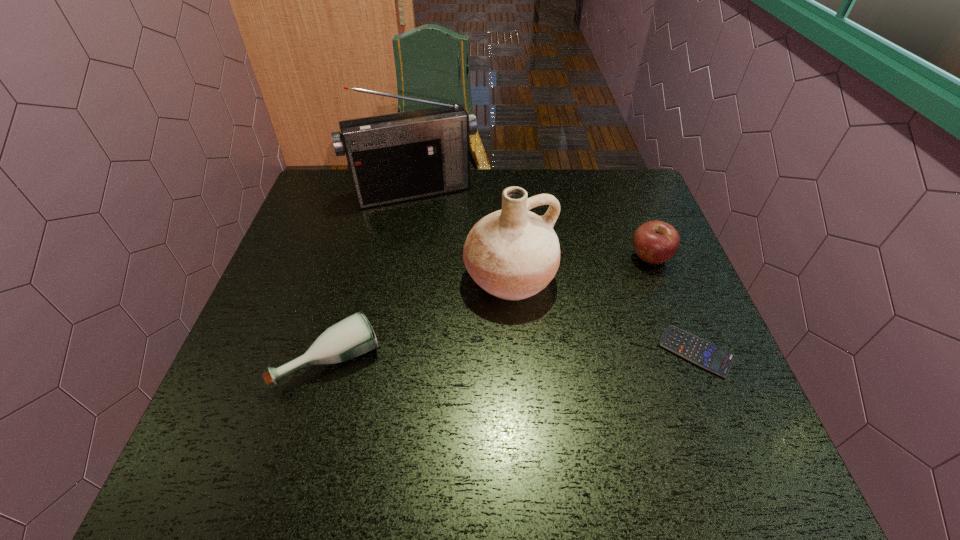
The height and width of the screenshot is (540, 960). Find the location of `bottle`. bottle is located at coordinates (353, 336).

Locate an element on the screen. The image size is (960, 540). the shortest object is located at coordinates (698, 351).

Where is `the tallest object`? This screenshot has width=960, height=540. the tallest object is located at coordinates pyautogui.click(x=396, y=157).

This screenshot has height=540, width=960. In order to click on the farthest object in this screenshot , I will do `click(396, 157)`.

At what (x,y) coordinates should I click in order to perform the action: click on the fourth shortest object. Please return your answer as a coordinate pair (x, y). Looking at the image, I should click on (513, 254).

Where is `apple`? apple is located at coordinates (655, 242).

Locate an element on the screen. The width and height of the screenshot is (960, 540). blank space located on the right of the bottle is located at coordinates (526, 360).

Find the location of a particular element. This screenshot has height=540, width=960. blank space located on the front of the shortest object is located at coordinates (716, 401).

You are a GUI agent. You are given a task and a screenshot of the screen. Output one action in this format:
    pyautogui.click(x=<x>, y=<y>)
    Task: Click on the free point located on the front-facing side of the radio receiver
    
    Given the screenshot: What is the action you would take?
    pyautogui.click(x=450, y=256)

Find the location of a particular element. free spot located on the front-facing side of the radio receiver is located at coordinates (446, 247).